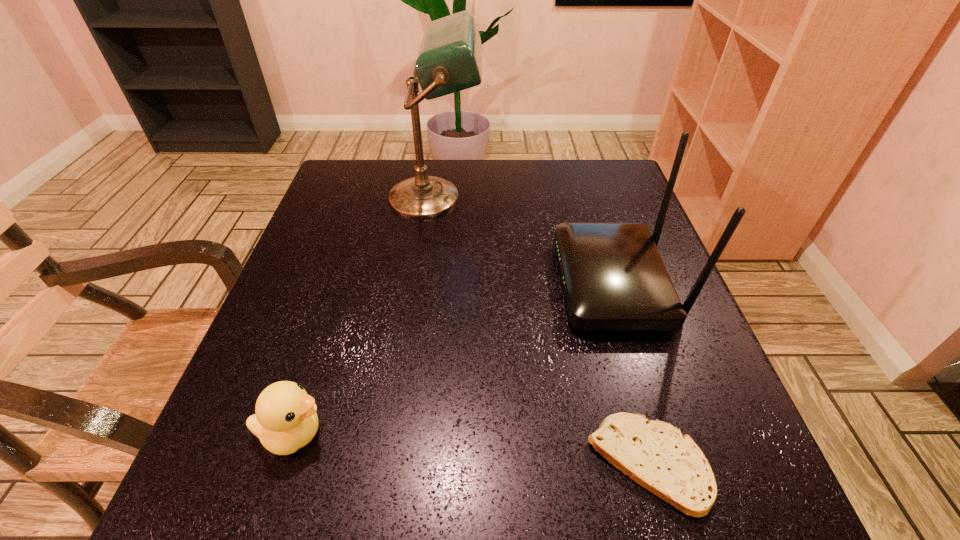
Where is `empty space between the pita bread and the table lamp`? empty space between the pita bread and the table lamp is located at coordinates (541, 330).

What are the coordinates of `vacant area that lies between the shortest object and the second shortest object` in the screenshot? It's located at (470, 448).

Where is `free space between the farthest object and the router`? free space between the farthest object and the router is located at coordinates (524, 240).

Identify the location of vacant area that lies between the third nearest object and the farthest object. pos(524,240).

In order to click on vacant space that's between the tallest object and the shortest object in this screenshot , I will do `click(541, 330)`.

Locate which object ranks second in proximity to the second tallest object. Please provide its 2D coordinates. Your answer should be formatted as a tuple, i.e. [(x, y)], where the tuple contains the x and y coordinates of a point satisfying the conditions above.

[(449, 60)]

In order to click on object that stands as the third closest to the shortest object in this screenshot , I will do `click(449, 60)`.

Locate an element on the screen. vacant position in the image that satisfies the following two spatial constraints: 1. on the face of the shortest object; 2. on the right side of the second shortest object is located at coordinates (283, 463).

This screenshot has width=960, height=540. In order to click on vacant space that satisfies the following two spatial constraints: 1. on the face of the duck; 2. on the back side of the pita bread in this screenshot , I will do `click(283, 463)`.